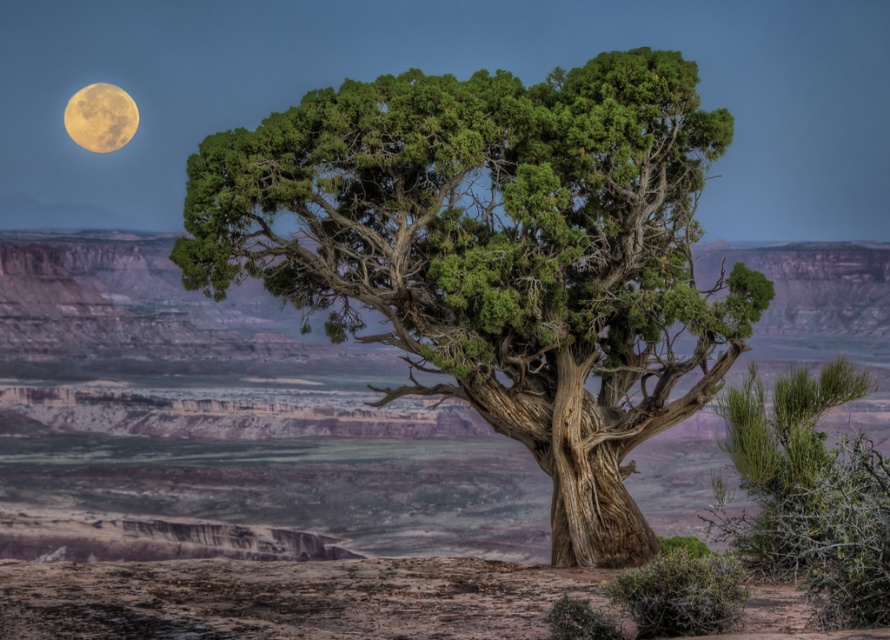
Is point (427, 342) farther from camera compared to point (74, 125)?

No, (427, 342) is closer to viewer.

Is green textured tree at center shorter than yellowish matte moon at upper left?

No.

Between point (623, 236) and point (73, 122), which one is positioned behind?

The point (73, 122) is more distant.

This screenshot has height=640, width=890. I want to click on green textured tree at center, so click(x=499, y=253).